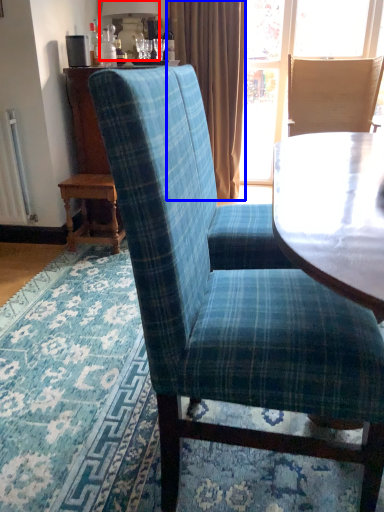
Question: Which of the following is the closest to the observer, lamp (highlighted by a red box) or curtain (highlighted by a blue box)?

Choices:
 (A) lamp
 (B) curtain

Answer: (A)